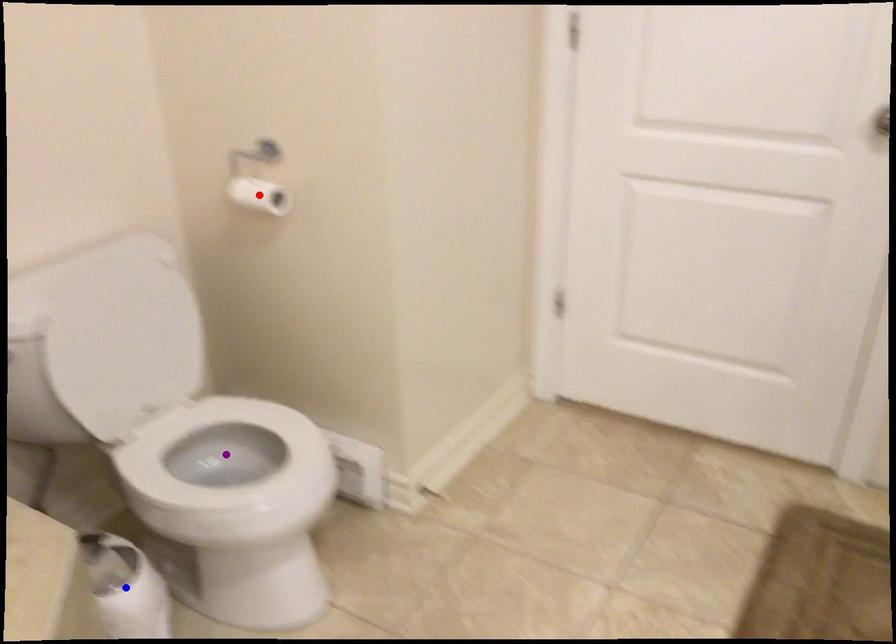
Order these from nearest to farthest:
A) purple point
B) blue point
C) red point

blue point < red point < purple point